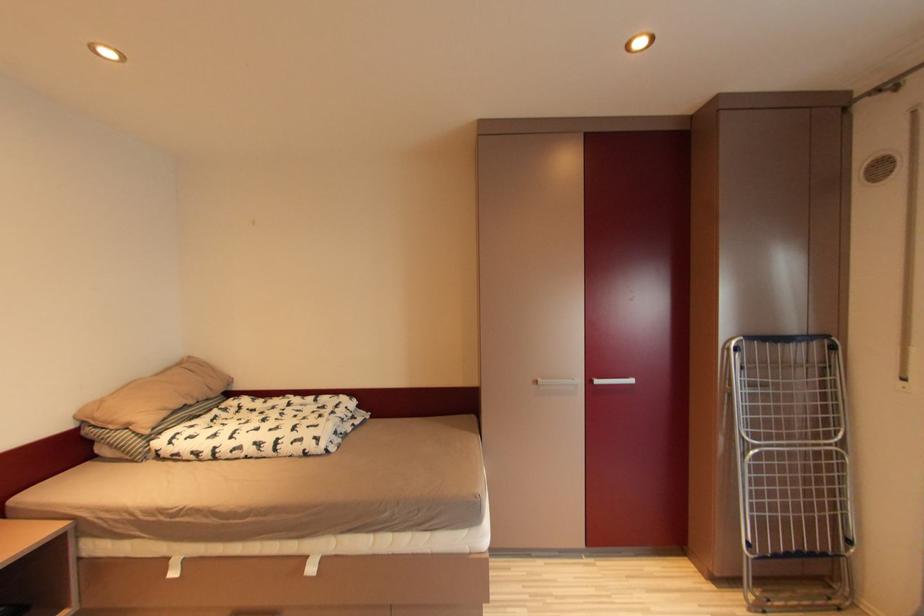
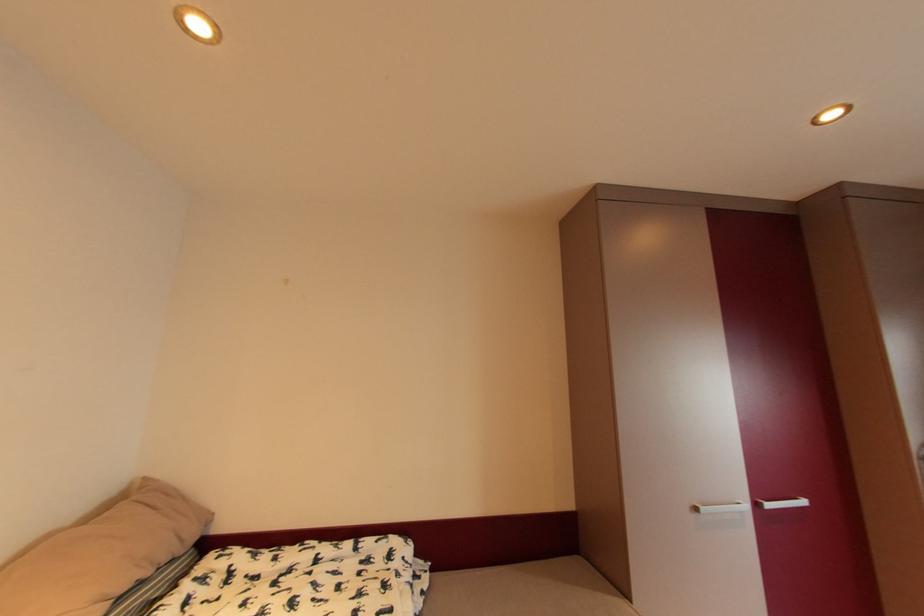
Question: Based on the continuous images, in which direction is the camera rotating? Reply with the corresponding letter.

Choices:
 (A) Left
 (B) Right
 (C) Up
 (D) Down

Answer: (C)